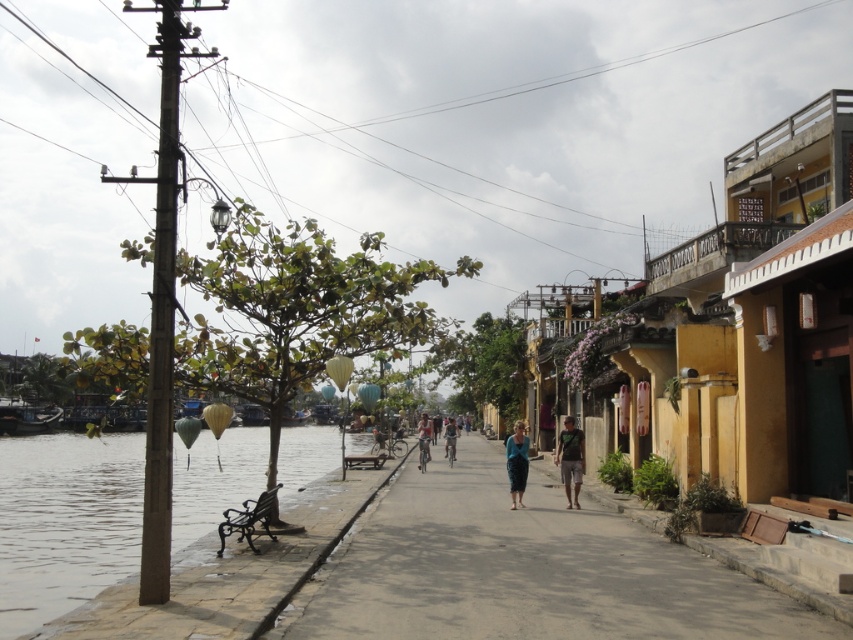
Can you confirm if smooth concrete pavement at center is smaller than green fabric shirt at center?

No.

Does smooth concrete pavement at center have a greater width compared to green fabric shirt at center?

Correct, the width of smooth concrete pavement at center exceeds that of green fabric shirt at center.

Is point (453, 600) less distant than point (579, 451)?

Yes, it is in front of point (579, 451).

Find the location of `smooth concrete pavement at center`. smooth concrete pavement at center is located at coordinates (523, 570).

In the scene shown: Is green fabric shirt at center to the left of blue fabric skirt at center from the viewer's perspective?

In fact, green fabric shirt at center is to the right of blue fabric skirt at center.

Can you confirm if green fabric shirt at center is bigger than blue fabric skirt at center?

No.

Who is more forward, (561,456) or (517,420)?

Point (561,456) is in front.

I want to click on green fabric shirt at center, so click(570, 460).

Who is taller, smooth concrete pavement at center or clear water at left?

With more height is clear water at left.

What are the coordinates of `smooth concrete pavement at center` in the screenshot? It's located at (523, 570).

Where is `smooth concrete pavement at center`? This screenshot has height=640, width=853. smooth concrete pavement at center is located at coordinates (523, 570).